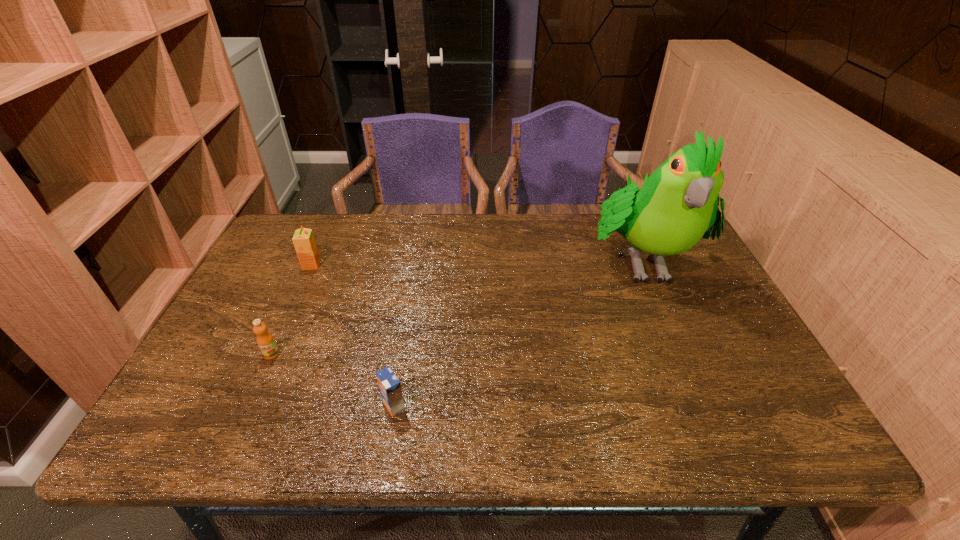
The image size is (960, 540). Identify the location of the closest object relative to the tallest object. coord(389,385).

Identify which orange_juice is the second closest to the rightmost orange_juice. Please provide its 2D coordinates. Your answer should be formatted as a tuple, i.e. [(x, y)], where the tuple contains the x and y coordinates of a point satisfying the conditions above.

[(304, 242)]

At what (x,y) coordinates should I click in order to perform the action: click on the closest orange_juice relative to the second object from right to left. Please return your answer as a coordinate pair (x, y). Image resolution: width=960 pixels, height=540 pixels. Looking at the image, I should click on (265, 340).